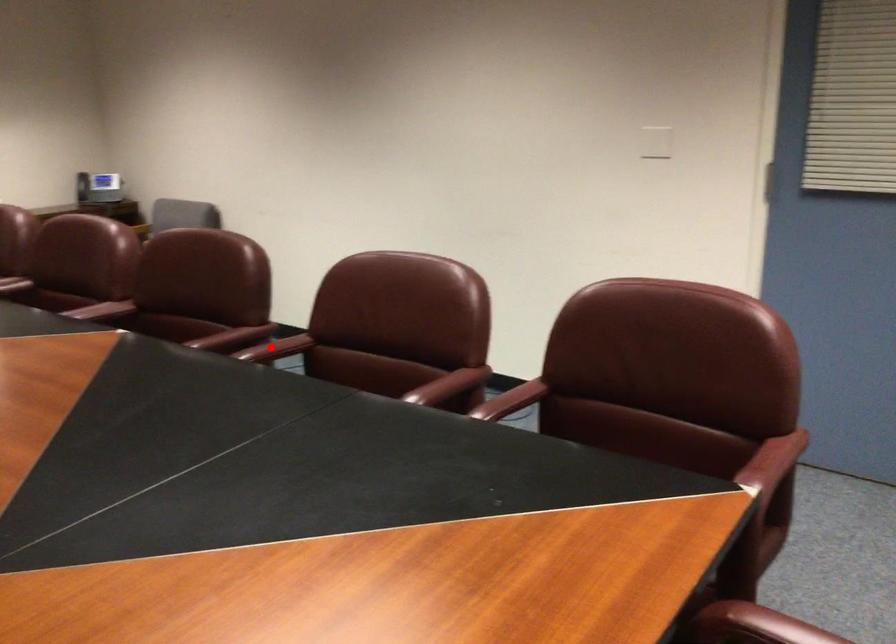
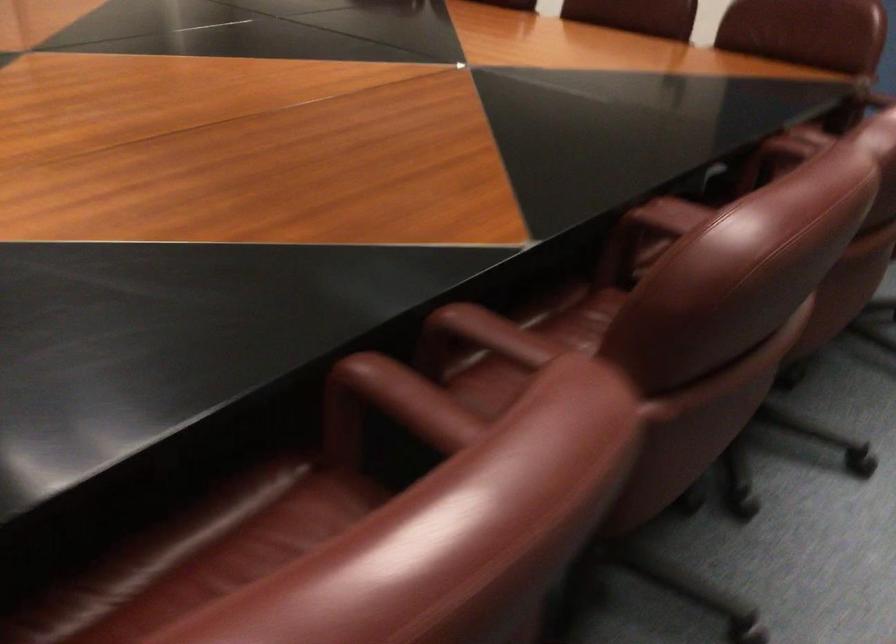
Question: I am providing you with two images of the same scene from different viewpoints. Given a red point in image1, look at the same physical point in image2. Is it:

Choices:
 (A) Closer to the viewpoint
 (B) Farther from the viewpoint

Answer: (A)